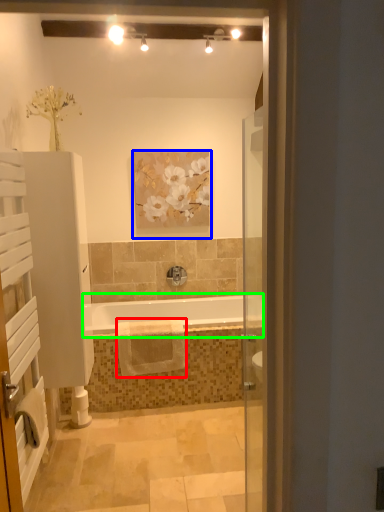
Question: Which is nearer to the bath towel (highlighted by a red box)? picture frame (highlighted by a blue box) or bathtub (highlighted by a green box).

Choices:
 (A) picture frame
 (B) bathtub

Answer: (B)